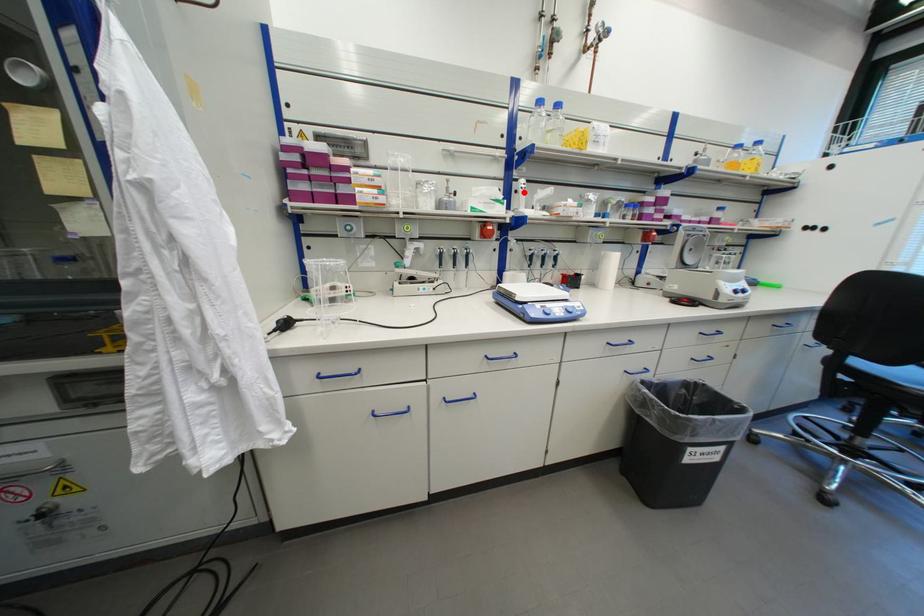
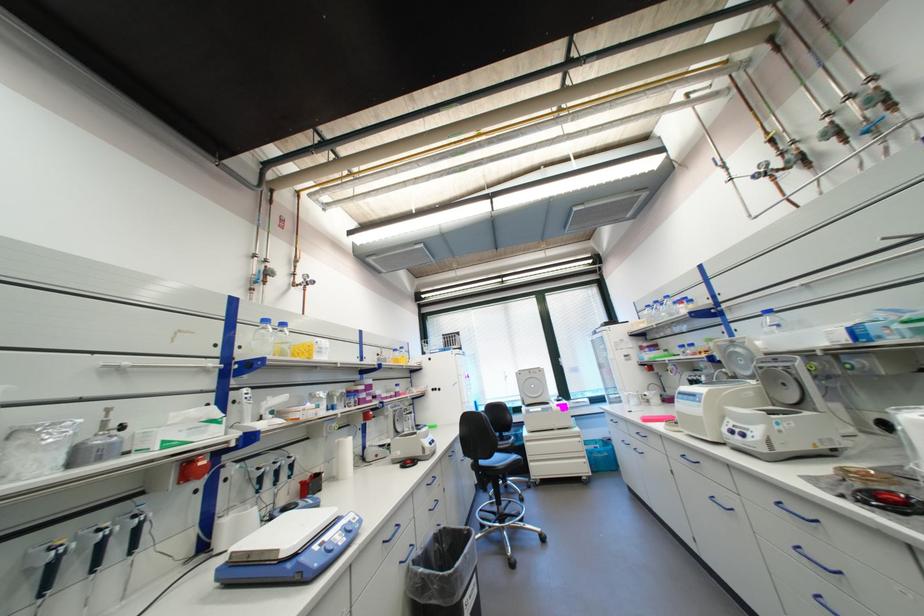
Question: I am providing you with two images of the same scene from different viewpoints. A red point is marked on the first image. Is the red point's position out of view in image 2?

Choices:
 (A) Yes
 (B) No

Answer: (B)